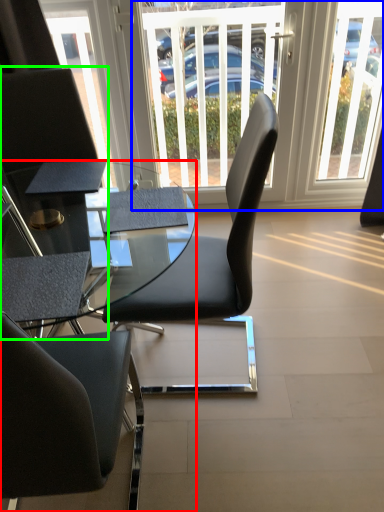
Question: Which is farther away from desk (highlighted by a red box)? window screen (highlighted by a blue box) or chair (highlighted by a green box)?

Choices:
 (A) window screen
 (B) chair

Answer: (A)